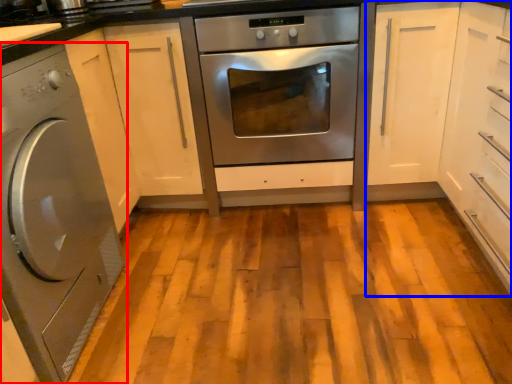
Question: Which object is further to the camera taking this photo, washing machine (highlighted by a red box) or cabinetry (highlighted by a blue box)?

Choices:
 (A) washing machine
 (B) cabinetry

Answer: (B)